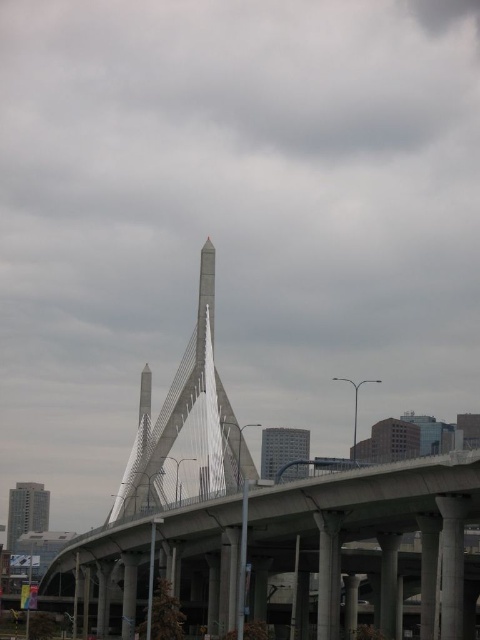
Question: Which object is farther from the camera taking this photo?

Choices:
 (A) white metallic pedestrian bridge at center
 (B) concrete bridge at center

Answer: (B)

Question: Can you confirm if white metallic pedestrian bridge at center is wider than concrete bridge at center?

Choices:
 (A) no
 (B) yes

Answer: (B)

Question: Among these points, which one is farthest from the camera?

Choices:
 (A) (230, 534)
 (B) (47, 586)

Answer: (B)

Question: Among these points, which one is nearest to the camera?

Choices:
 (A) (384, 477)
 (B) (136, 595)

Answer: (A)

Question: Considering the relative positions of white metallic pedestrian bridge at center and concrete bridge at center in the image provided, where is white metallic pedestrian bridge at center located with respect to concrete bridge at center?

Choices:
 (A) left
 (B) right

Answer: (B)

Question: Is white metallic pedestrian bridge at center below concrete bridge at center?

Choices:
 (A) no
 (B) yes

Answer: (A)